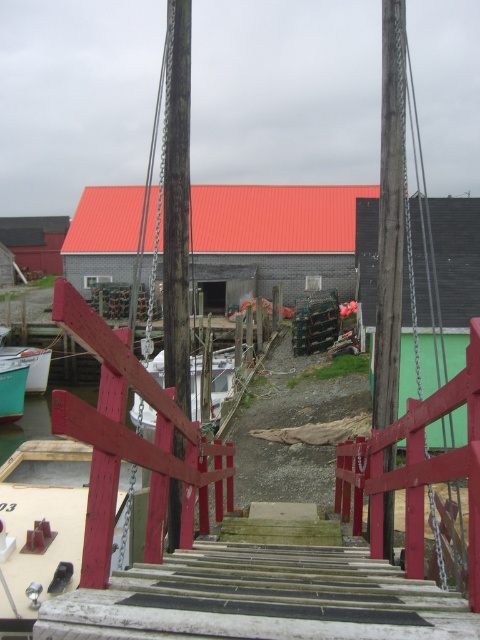
You are standing at the top of the wooden stairs in the harbor scene. You notice two points marked on the image, one at point coordinates (x=383, y=61) and the other at (x=12, y=348). Which point is nearer to your current position?

Point (x=383, y=61) is closer to the camera than point (x=12, y=348), so the point at (x=383, y=61) is nearer to your current position at the top of the stairs.